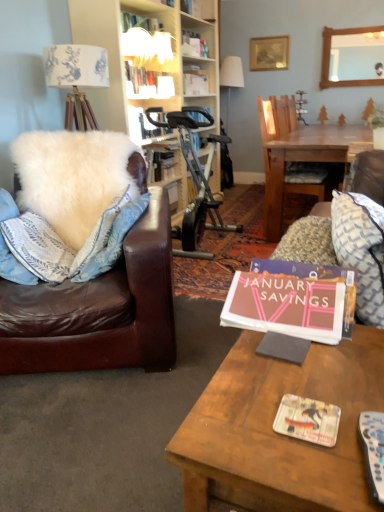
I want to click on unoccupied area behind white plastic remote control at lower right, so click(329, 389).